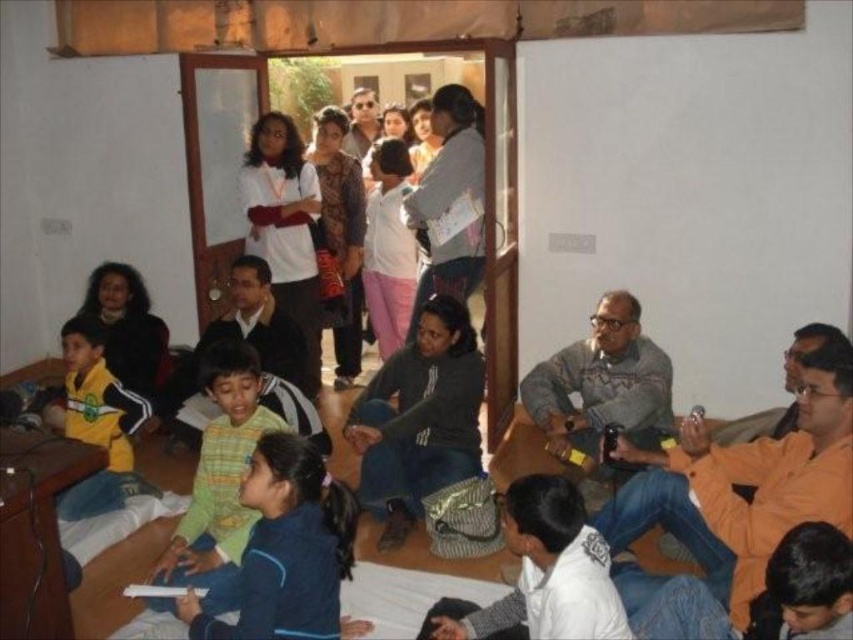
Question: Does blue fleece jacket at lower left appear over striped knit sweater at center?

Choices:
 (A) no
 (B) yes

Answer: (A)

Question: Observing the image, what is the correct spatial positioning of dark gray fabric jacket at center in reference to striped knit sweater at center?

Choices:
 (A) right
 (B) left

Answer: (A)

Question: Based on their relative distances, which object is farther from the striped knit sweater at center?

Choices:
 (A) yellow jersey at left
 (B) blue fleece jacket at lower left
 (C) dark gray fabric jacket at center

Answer: (A)

Question: Among these objects, which one is nearest to the camera?

Choices:
 (A) blue fleece jacket at lower left
 (B) dark gray fabric jacket at center
 (C) yellow jersey at left
 (D) striped knit sweater at center

Answer: (A)

Question: Does dark gray fabric jacket at center have a greater width compared to yellow jersey at left?

Choices:
 (A) yes
 (B) no

Answer: (A)

Question: Considering the real-world distances, which object is farthest from the blue fleece jacket at lower left?

Choices:
 (A) dark gray fabric jacket at center
 (B) yellow jersey at left
 (C) striped knit sweater at center

Answer: (B)